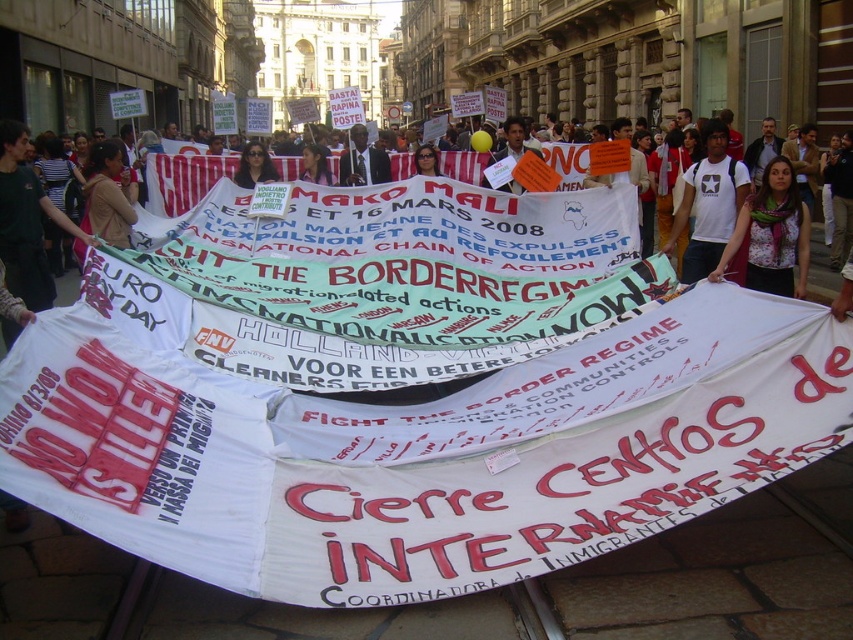
Is point (762, 189) positioned in front of point (352, 182)?

Yes, it is.

From the picture: Is floral fabric scarf at center smaller than dark skin man at center?

Correct, floral fabric scarf at center occupies less space than dark skin man at center.

You are a GUI agent. You are given a task and a screenshot of the screen. Output one action in this format:
    pyautogui.click(x=<x>, y=<y>)
    Task: Click on the floral fabric scarf at center
    This screenshot has width=853, height=640.
    Given the screenshot: What is the action you would take?
    pyautogui.click(x=769, y=236)

The image size is (853, 640). I want to click on floral fabric scarf at center, so click(x=769, y=236).

Measure the distance between point (791,264) and camera.

Point (791,264) is 44.29 meters from camera.

Find the location of a particular element. The width and height of the screenshot is (853, 640). floral fabric scarf at center is located at coordinates (769, 236).

Which is below, white t-shirt at center or dark skin man at center?

Positioned lower is white t-shirt at center.

Describe the element at coordinates (708, 204) in the screenshot. Image resolution: width=853 pixels, height=640 pixels. I see `white t-shirt at center` at that location.

Measure the distance between point (682, 216) and camera.

They are 169.40 feet apart.

Where is `white t-shirt at center`? This screenshot has width=853, height=640. white t-shirt at center is located at coordinates (708, 204).